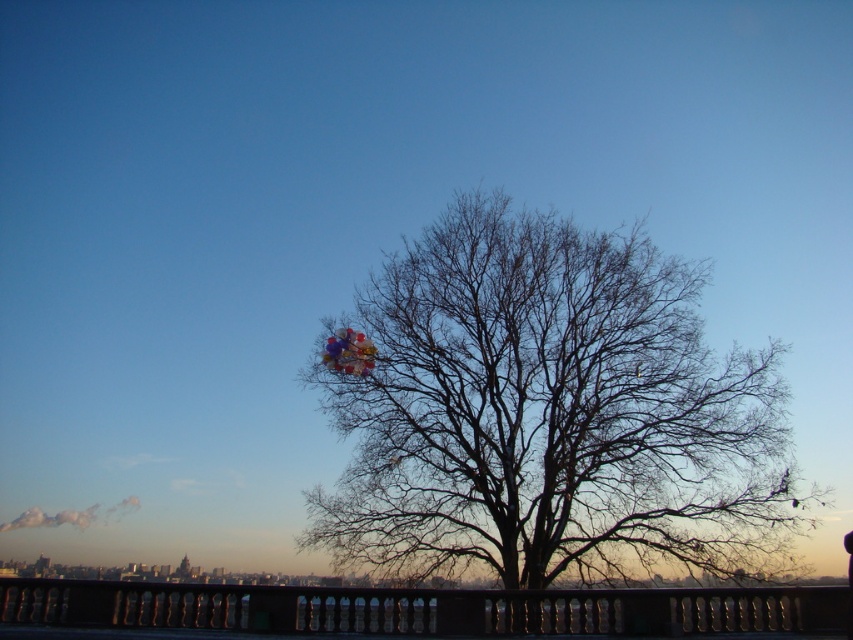
Question: Can you confirm if bare branches at center is wider than multicolored glossy balloons at center?

Choices:
 (A) no
 (B) yes

Answer: (B)

Question: Estimate the real-world distances between objects in this image. Which object is farther from the multicolored glossy balloons at center?

Choices:
 (A) black metal railing at lower center
 (B) bare branches at center

Answer: (A)

Question: In this image, where is bare branches at center located relative to multicolored glossy balloons at center?

Choices:
 (A) right
 (B) left

Answer: (A)

Question: Which object is positioned closest to the multicolored glossy balloons at center?

Choices:
 (A) bare branches at center
 (B) black metal railing at lower center

Answer: (A)

Question: Which point is farther to the camera?

Choices:
 (A) (340, 362)
 (B) (701, 376)
 (C) (143, 625)

Answer: (B)

Question: In this image, where is black metal railing at lower center located relative to multicolored glossy balloons at center?

Choices:
 (A) left
 (B) right

Answer: (B)